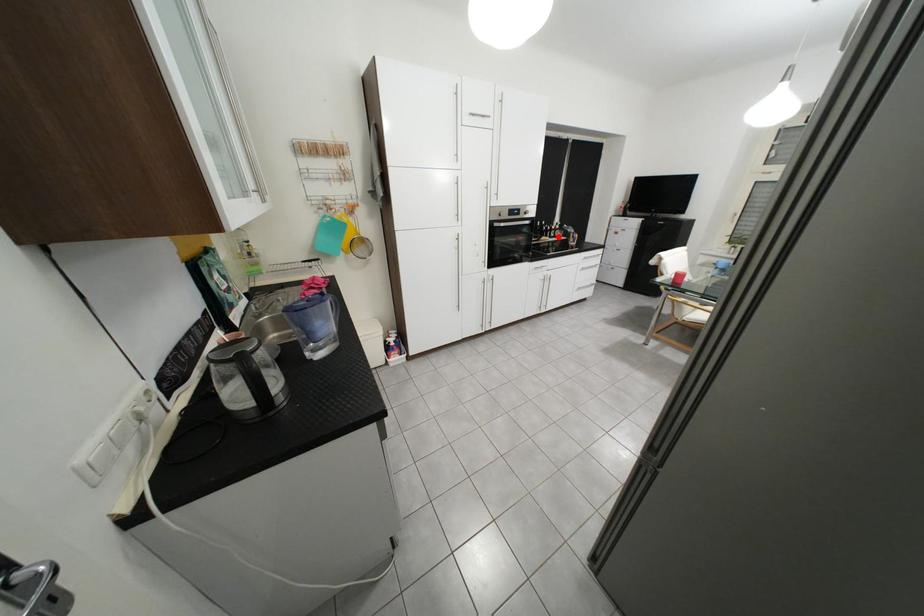
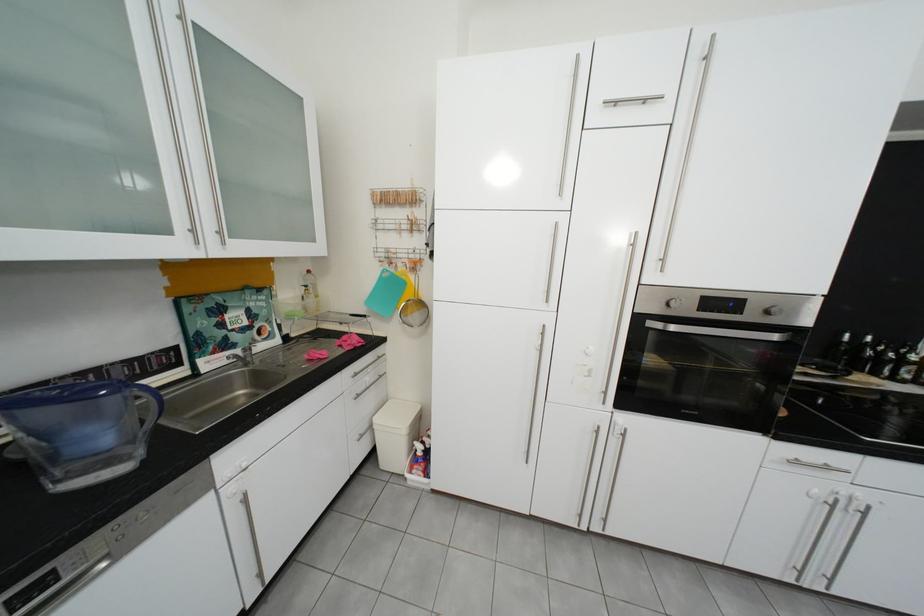
Question: A red point is marked in image1. In image2, is the corresponding 3D point closer to the camera or farther? Reply with the corresponding letter.

Choices:
 (A) The corresponding 3D point is closer.
 (B) The corresponding 3D point is farther.

Answer: (B)